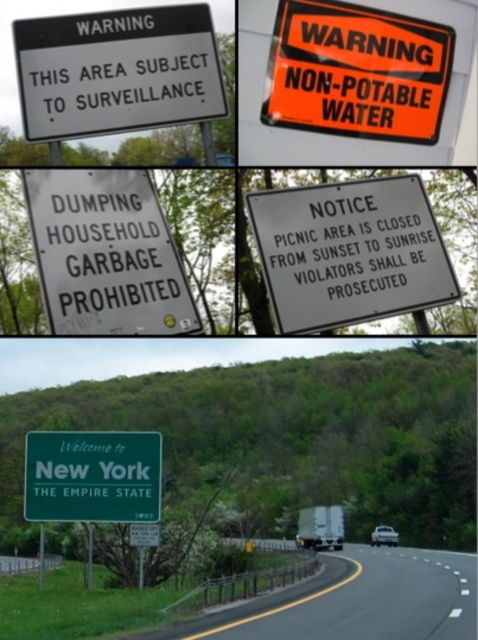
Question: Which object is the closest to the orange reflective sign at upper center?

Choices:
 (A) green asphalt road at lower center
 (B) white plastic sign at upper left

Answer: (B)

Question: Which point is closer to the camera taking this photo?

Choices:
 (A) (121, 177)
 (B) (317, 10)
 (C) (401, 550)
 (D) (112, 22)

Answer: (B)

Question: Considering the relative positions of green asphalt road at lower center and orange reflective sign at upper center in the image provided, where is green asphalt road at lower center located with respect to orange reflective sign at upper center?

Choices:
 (A) above
 (B) below

Answer: (B)

Question: Can you confirm if white plastic sign at upper left is positioned above green matte signboard at center?

Choices:
 (A) yes
 (B) no

Answer: (A)

Question: Which is farther from the white paper notice at center?

Choices:
 (A) green asphalt road at lower center
 (B) white plastic sign at upper left

Answer: (A)

Question: Can you confirm if white plastic sign at upper left is positioned to the left of white paper sign at center?

Choices:
 (A) yes
 (B) no

Answer: (B)